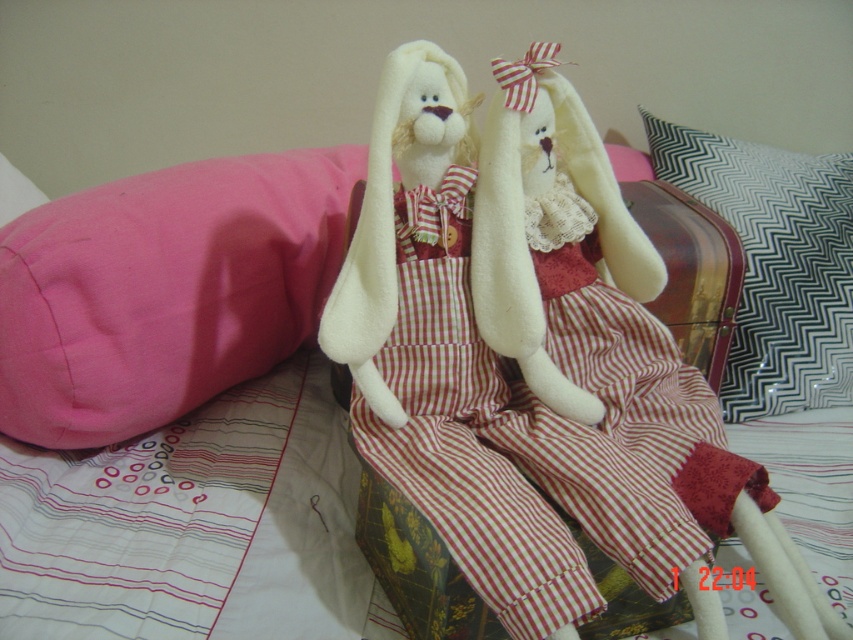
Question: From the image, what is the correct spatial relationship of red plaid fabric dress at center in relation to black and white zigzag pillow at upper right?

Choices:
 (A) above
 (B) below

Answer: (B)

Question: Which object is the closest to the black and white zigzag pillow at upper right?

Choices:
 (A) red plaid fabric dress at center
 (B) pink fabric pillow at left

Answer: (A)

Question: Does red plaid fabric dress at center appear over black and white zigzag pillow at upper right?

Choices:
 (A) yes
 (B) no

Answer: (B)

Question: Among these objects, which one is farthest from the camera?

Choices:
 (A) black and white zigzag pillow at upper right
 (B) red plaid fabric dress at center

Answer: (A)

Question: Which point is farther to the camera?

Choices:
 (A) (200, 296)
 (B) (851, 396)
 (C) (448, 401)

Answer: (B)

Question: Is red plaid fabric dress at center further to camera compared to pink fabric pillow at left?

Choices:
 (A) yes
 (B) no

Answer: (B)